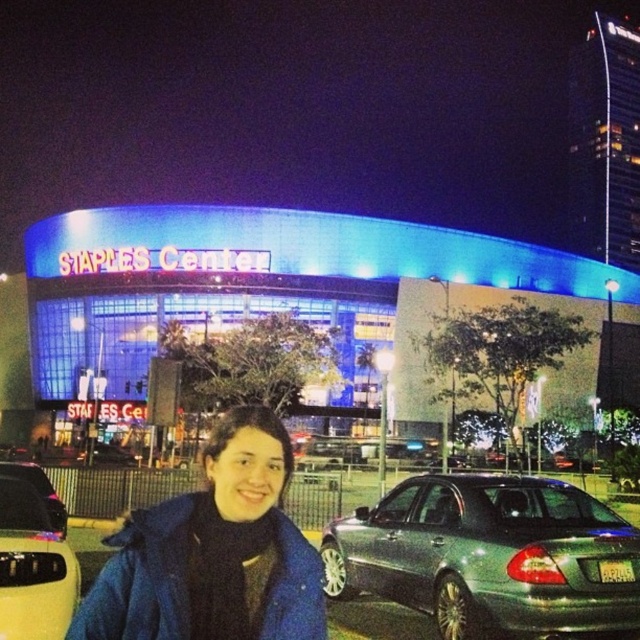
Question: Is blue illuminated building at center positioned behind metallic silver sedan at center?

Choices:
 (A) yes
 (B) no

Answer: (A)

Question: Estimate the real-world distances between objects in this image. Which object is farther from the metallic silver sedan at center?

Choices:
 (A) blue illuminated building at center
 (B) metallic silver sedan at lower left
 (C) blue fleece jacket at center

Answer: (A)

Question: Which object is farther from the camera taking this photo?

Choices:
 (A) metallic silver sedan at center
 (B) blue fleece jacket at center
 (C) metallic silver sedan at lower left

Answer: (A)

Question: Is blue illuminated building at center below metallic silver sedan at lower left?

Choices:
 (A) yes
 (B) no

Answer: (B)

Question: Which object appears farthest from the camera in this image?

Choices:
 (A) blue illuminated building at center
 (B) blue fleece jacket at center
 (C) metallic silver sedan at center

Answer: (A)

Question: Does metallic silver sedan at center appear on the left side of blue fleece jacket at center?

Choices:
 (A) yes
 (B) no

Answer: (B)